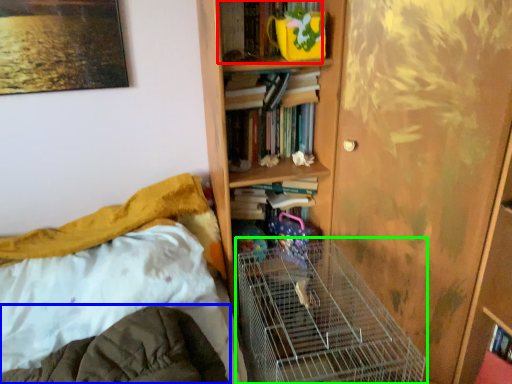
Question: Which is farther away from book (highlighted by a red box)? blanket (highlighted by a blue box) or bird cage (highlighted by a green box)?

Choices:
 (A) blanket
 (B) bird cage

Answer: (A)